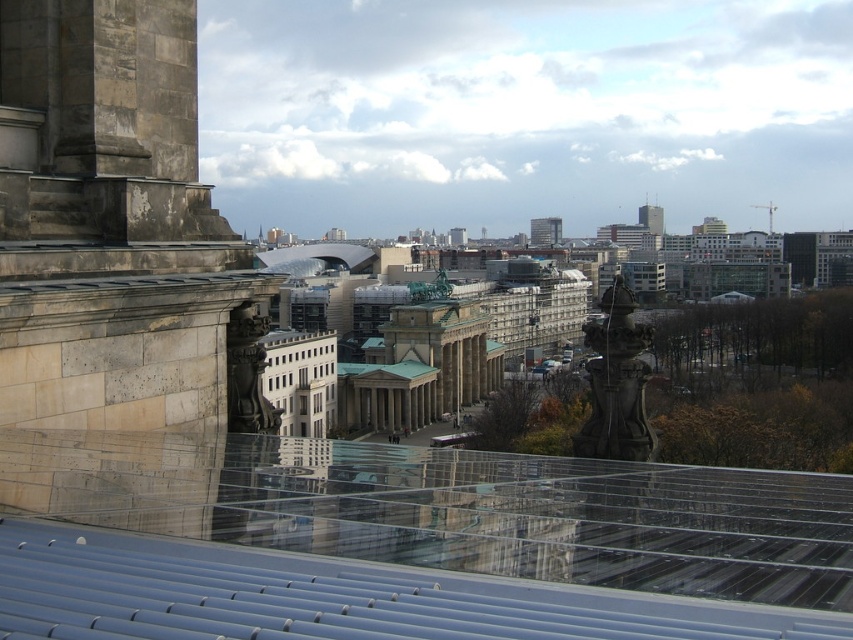
Question: Estimate the real-world distances between objects in this image. Which object is closer to the polished stone column at center?

Choices:
 (A) smooth glass tower at center
 (B) beige stone tower at left

Answer: (B)

Question: Which object appears farthest from the camera in this image?

Choices:
 (A) smooth glass tower at center
 (B) transparent glass roof at center

Answer: (A)

Question: From the image, what is the correct spatial relationship of polished stone column at center in relation to metallic glass tower at center?

Choices:
 (A) left
 (B) right

Answer: (A)

Question: Does polished stone column at center have a smaller size compared to metallic glass tower at center?

Choices:
 (A) no
 (B) yes

Answer: (A)

Question: Can you confirm if polished stone column at center is positioned to the left of smooth glass tower at center?

Choices:
 (A) yes
 (B) no

Answer: (A)

Question: Estimate the real-world distances between objects in this image. Which object is farther from the transparent glass roof at center?

Choices:
 (A) polished stone column at center
 (B) metallic glass tower at center
 (C) smooth glass tower at center
 (D) beige stone tower at left

Answer: (C)